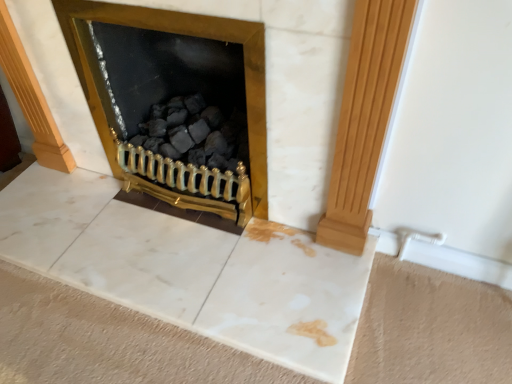
I want to click on free space to the left of light brown wood pillar at right, so click(281, 242).